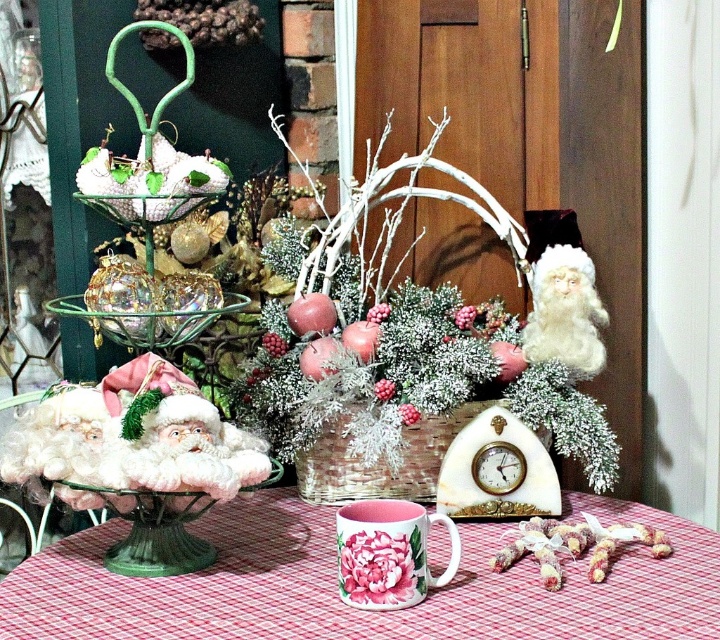
Question: Based on their relative distances, which object is farther from the pink ceramic mug at lower center?

Choices:
 (A) white marble clock at center
 (B) frosted white basket at center

Answer: (B)

Question: Does pink ceramic mug at lower center appear on the left side of pink floral mug at center?

Choices:
 (A) no
 (B) yes

Answer: (B)

Question: Which of the following is the farthest from the observer?

Choices:
 (A) (233, 560)
 (B) (500, 438)
 (C) (567, 392)
 (D) (567, 316)

Answer: (C)

Question: Is white marble clock at center wider than pink floral mug at center?

Choices:
 (A) yes
 (B) no

Answer: (A)

Question: Can you confirm if frosted white basket at center is bigger than pink floral mug at center?

Choices:
 (A) no
 (B) yes

Answer: (B)

Question: Which of the following is the farthest from the observer?

Choices:
 (A) (593, 346)
 (B) (282, 522)

Answer: (A)